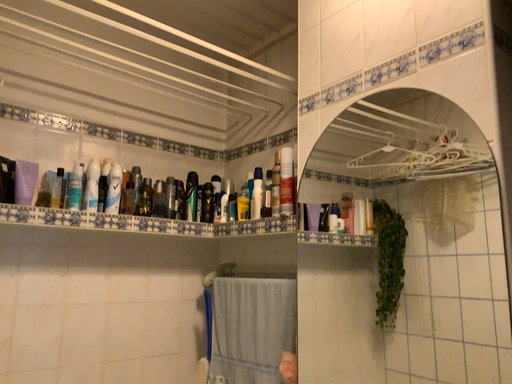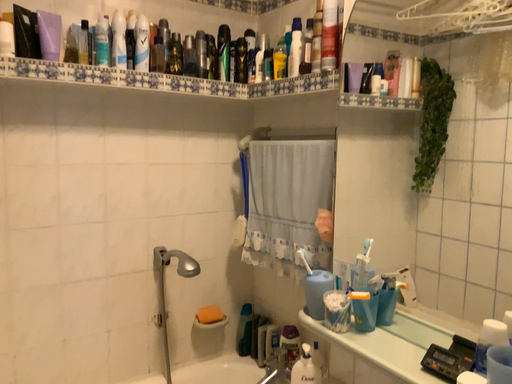
Question: How did the camera likely rotate when shooting the video?

Choices:
 (A) rotated upward
 (B) rotated downward

Answer: (B)